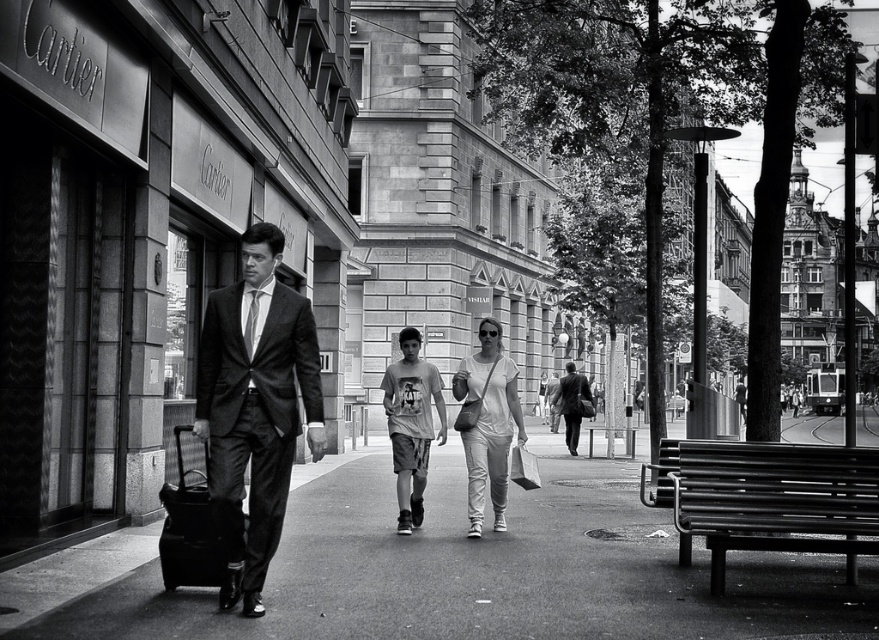
Question: Is light gray t-shirt at center above matte black suit at center?

Choices:
 (A) no
 (B) yes

Answer: (B)

Question: Which point appears closest to the camera in this image?

Choices:
 (A) (259, 390)
 (B) (568, 378)
 (C) (476, 524)

Answer: (A)

Question: Which point is farther to the camera?

Choices:
 (A) dark gray suit at center
 (B) light gray t-shirt at center
 (C) white cotton t-shirt at center

Answer: (C)

Question: Does white cotton t-shirt at center appear over light gray t-shirt at center?

Choices:
 (A) yes
 (B) no

Answer: (B)

Question: Does smooth asphalt pavement at center appear under matte black suit at center?

Choices:
 (A) no
 (B) yes

Answer: (B)

Question: Which point is farther to the camera?

Choices:
 (A) smooth asphalt pavement at center
 (B) light gray t-shirt at center

Answer: (B)